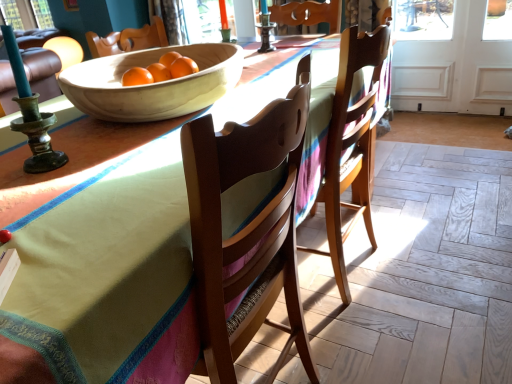
What do you see at coordinates (265, 28) in the screenshot?
I see `matte dark brown candle holder at upper center` at bounding box center [265, 28].

Looking at this image, in order to face wooden table at center, should I rotate leftwards or rightwards?

Rotate left and turn 6.022 degrees.

The width and height of the screenshot is (512, 384). What do you see at coordinates (105, 276) in the screenshot?
I see `wooden table at center` at bounding box center [105, 276].

Where is `white wood screen door at right`? The image size is (512, 384). white wood screen door at right is located at coordinates (423, 56).

From a real-world perspective, is natural wood bowl at center over white wood screen door at right?

Yes.

Is natural wood bowl at center thinner than white wood screen door at right?

In fact, natural wood bowl at center might be wider than white wood screen door at right.

Is natural wood bowl at center turned away from white wood screen door at right?

No, white wood screen door at right is not at the back of natural wood bowl at center.

Considering the relative sizes of white wood screen door at right and wooden table at center in the image provided, is white wood screen door at right smaller than wooden table at center?

Yes.

Is white wood screen door at right at the left side of wooden table at center?

No, white wood screen door at right is not to the left of wooden table at center.

From a real-world perspective, is white wood screen door at right above or below wooden table at center?

white wood screen door at right is below wooden table at center.

Looking at this image, is white wood screen door at right further to camera compared to wooden table at center?

Yes, white wood screen door at right is further from the viewer.

Looking at this image, in terms of width, does white wood screen door at right look wider or thinner when compared to matte dark brown candle holder at upper center?

white wood screen door at right is thinner than matte dark brown candle holder at upper center.

Between white wood screen door at right and matte dark brown candle holder at upper center, which one appears on the right side from the viewer's perspective?

From the viewer's perspective, white wood screen door at right appears more on the right side.

Between point (265, 33) and point (398, 101), which one is positioned in front?

The point (265, 33) is closer.

Is matte dark brown candle holder at upper center not near white wood screen door at right?

Yes, matte dark brown candle holder at upper center and white wood screen door at right are quite far apart.

Which of these two, matte dark brown candle holder at upper center or white wood screen door at right, stands shorter?

matte dark brown candle holder at upper center.

Is matte dark brown candle holder at upper center in front of white wood screen door at right?

Yes, it is in front of white wood screen door at right.

From a real-world perspective, is wooden table at center under matte dark brown candle holder at upper center?

Yes, from a real-world perspective, wooden table at center is below matte dark brown candle holder at upper center.

From the image's perspective, is wooden table at center above or below matte dark brown candle holder at upper center?

Based on their image positions, wooden table at center is located beneath matte dark brown candle holder at upper center.

Is wooden table at center taller or shorter than matte dark brown candle holder at upper center?

Considering their sizes, wooden table at center has more height than matte dark brown candle holder at upper center.

Can you see wooden table at center touching matte dark brown candle holder at upper center?

There is a gap between wooden table at center and matte dark brown candle holder at upper center.

Is wooden table at center oriented towards natural wood bowl at center?

No, wooden table at center is not facing towards natural wood bowl at center.

In the image, is wooden table at center on the left side or the right side of natural wood bowl at center?

wooden table at center is positioned on natural wood bowl at center's right side.

Between wooden table at center and natural wood bowl at center, which one has less height?

Standing shorter between the two is natural wood bowl at center.

Is wooden table at center turned away from white wood screen door at right?

That's not correct — wooden table at center is not looking away from white wood screen door at right.

Considering the relative positions of wooden table at center and white wood screen door at right in the image provided, is wooden table at center to the left of white wood screen door at right from the viewer's perspective?

Indeed, wooden table at center is positioned on the left side of white wood screen door at right.

Is wooden table at center beside white wood screen door at right?

They are not placed beside each other.

Considering the sizes of objects wooden table at center and white wood screen door at right in the image provided, who is shorter, wooden table at center or white wood screen door at right?

wooden table at center is shorter.

I want to click on bowl positioned vertically above the white wood screen door at right (from a real-world perspective), so click(x=152, y=84).

Image resolution: width=512 pixels, height=384 pixels. I want to click on desk below the white wood screen door at right (from the image's perspective), so click(x=105, y=276).

Estimate the real-world distances between objects in this image. Which object is further from matte dark brown candle holder at upper center, natural wood bowl at center or white wood screen door at right?

white wood screen door at right.

Looking at the image, which one is located closer to natural wood bowl at center, wooden table at center or matte dark brown candle holder at upper center?

Among the two, wooden table at center is located nearer to natural wood bowl at center.

Estimate the real-world distances between objects in this image. Which object is further from matte dark brown candle holder at upper center, natural wood bowl at center or wooden table at center?

The object further to matte dark brown candle holder at upper center is wooden table at center.

Considering their positions, is natural wood bowl at center positioned further to wooden table at center than matte dark brown candle holder at upper center?

matte dark brown candle holder at upper center lies further to wooden table at center than the other object.

Estimate the real-world distances between objects in this image. Which object is further from matte dark brown candle holder at upper center, wooden table at center or white wood screen door at right?

white wood screen door at right.

Consider the image. Estimate the real-world distances between objects in this image. Which object is further from white wood screen door at right, natural wood bowl at center or matte dark brown candle holder at upper center?

The object further to white wood screen door at right is natural wood bowl at center.

Which object lies further to the anchor point wooden table at center, white wood screen door at right or matte dark brown candle holder at upper center?

white wood screen door at right is further to wooden table at center.

Looking at the image, which one is located closer to white wood screen door at right, matte dark brown candle holder at upper center or natural wood bowl at center?

matte dark brown candle holder at upper center.

Locate an element on the screen. The width and height of the screenshot is (512, 384). candle holder between wooden table at center and white wood screen door at right in the front-back direction is located at coordinates (265, 28).

This screenshot has height=384, width=512. Find the location of `bowl located between wooden table at center and white wood screen door at right in the depth direction`. bowl located between wooden table at center and white wood screen door at right in the depth direction is located at coordinates (152, 84).

Image resolution: width=512 pixels, height=384 pixels. Find the location of `bowl between wooden table at center and matte dark brown candle holder at upper center from front to back`. bowl between wooden table at center and matte dark brown candle holder at upper center from front to back is located at coordinates (152, 84).

The width and height of the screenshot is (512, 384). I want to click on candle holder between natural wood bowl at center and white wood screen door at right along the z-axis, so click(265, 28).